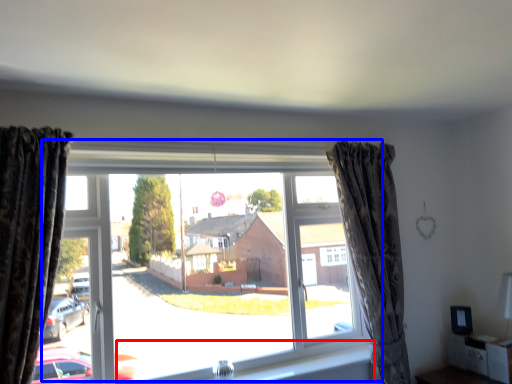
Question: Which object is closer to the camera taking this photo, window sill (highlighted by a red box) or window (highlighted by a blue box)?

Choices:
 (A) window sill
 (B) window

Answer: (B)